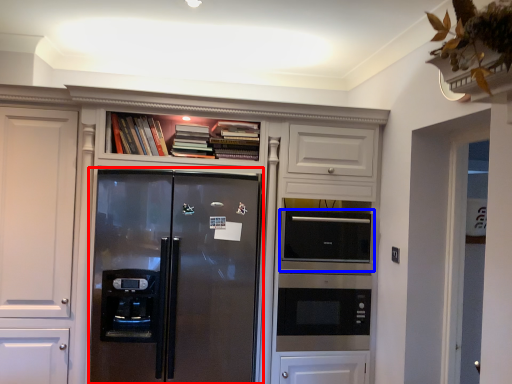
Question: Which of the following is the closest to the observer, refrigerator (highlighted by a red box) or appliance (highlighted by a blue box)?

Choices:
 (A) refrigerator
 (B) appliance

Answer: (A)